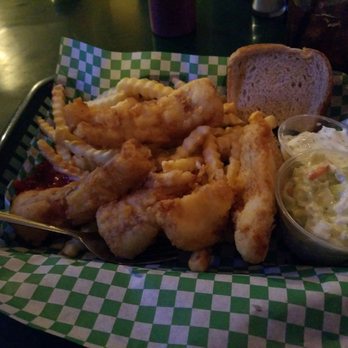
Where is `utensil`? utensil is located at coordinates (50, 229).